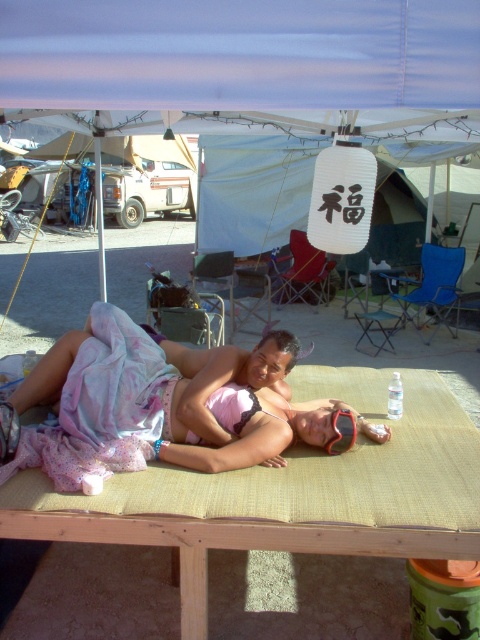
You are organizing a picnic and need to place two bottles on a table. The scene shows a transparent plastic bottle at center and a clear plastic bottle at center. Which bottle is located to the right of the other?

The transparent plastic bottle at center is positioned on the right side of the clear plastic bottle at center.

Consider the image. You are standing at the entrance of the tent and want to grab the transparent plastic bottle at center. Which direction should you move towards to reach it?

The transparent plastic bottle at center is located at point (395, 396) in 2D coordinates, so you should move towards the center of the tent to reach it.

Looking at this image, you are standing in front of the canopy tent and want to determine which of the two points, point (19, 433) or point (34, 362), is closer to you. Based on the coordinates provided, which point is nearer?

Point (19, 433) is closer to the camera than point (34, 362), so it is the nearer one.